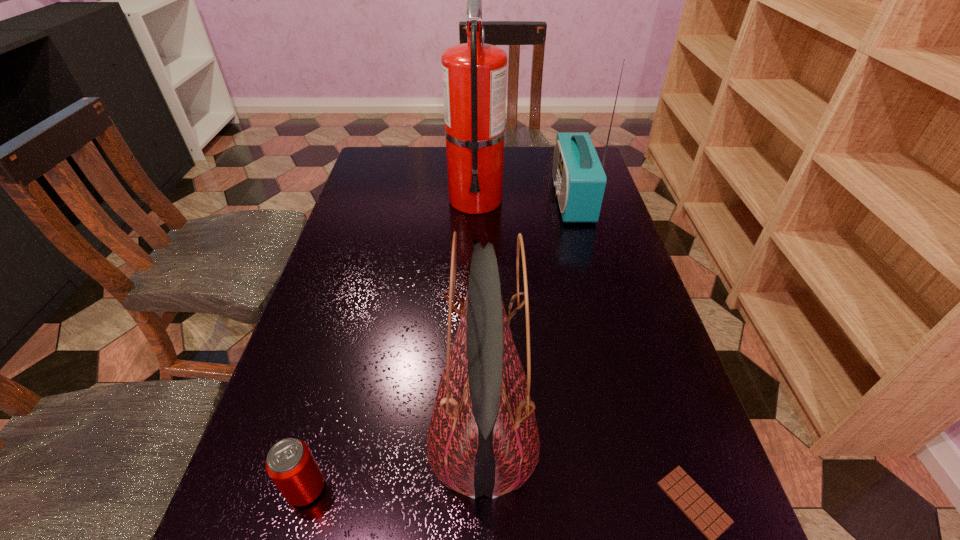
You are a GUI agent. You are given a task and a screenshot of the screen. Output one action in this format:
    pyautogui.click(x=<x>, y=<y>)
    Task: Click on the free space between the fire extinguisher and the can
    The width and height of the screenshot is (960, 540).
    Given the screenshot: What is the action you would take?
    pyautogui.click(x=391, y=344)

This screenshot has width=960, height=540. Find the location of `vacant point located between the fire extinguisher and the second shortest object`. vacant point located between the fire extinguisher and the second shortest object is located at coordinates point(391,344).

Identify the location of the third closest object relative to the shortest object. The image size is (960, 540). (578, 176).

At what (x,y) coordinates should I click in order to perform the action: click on the closest object to the radio receiver. Please return your answer as a coordinate pair (x, y). This screenshot has width=960, height=540. Looking at the image, I should click on (474, 74).